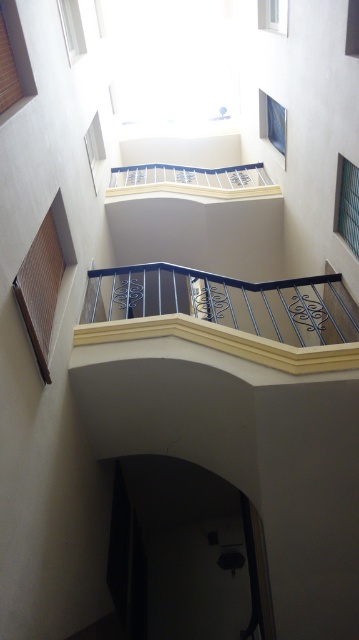
Consider the image. You are an interior designer planning to place a large potted plant between the metallic wrought iron balcony at center and the clear glass window at upper right. Based on their positions, which object should the plant be closer to?

The metallic wrought iron balcony at center is to the left of the clear glass window at upper right, so placing the plant between them would mean it is closer to the metallic wrought iron balcony at center.

You are standing at the base of the structure and want to reach the point marked at coordinates point (x=155, y=307). If your ladder can extend up to 8 meters, will it be sufficient to reach that point?

The distance of point (x=155, y=307) from the camera is 7.90 meters, so yes, the ladder can reach it since it is shorter than the ladder maximum extension of 8 meters.

You are an architect designing a new building and want to ensure proper ventilation. You have two clear glass windows available. The clear glass window at upper left and the clear glass window at upper center. Which window should you choose for a larger ventilation area?

The clear glass window at upper center should be chosen for a larger ventilation area because it is larger than the clear glass window at upper left.